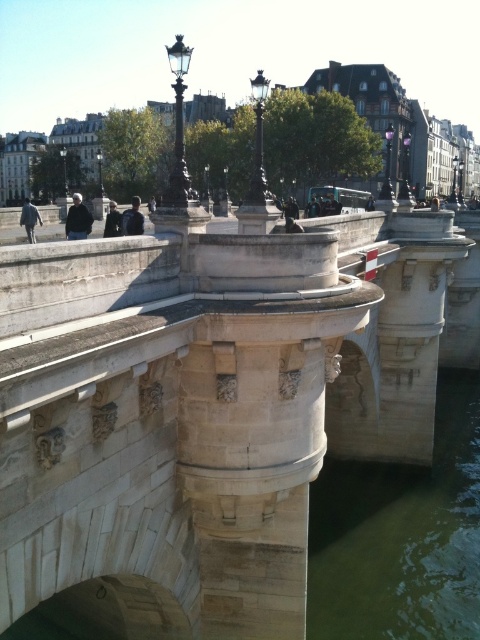
Who is more distant from viewer, (420, 460) or (368, 554)?

The point (420, 460) is more distant.

Between beige stone bridge at center and green stone water at lower right, which one is positioned higher?

beige stone bridge at center is above.

What do you see at coordinates (213, 403) in the screenshot?
I see `beige stone bridge at center` at bounding box center [213, 403].

You are a GUI agent. You are given a task and a screenshot of the screen. Output one action in this format:
    pyautogui.click(x=<x>, y=<y>)
    Task: Click on the beige stone bridge at center
    The height and width of the screenshot is (640, 480).
    Given the screenshot: What is the action you would take?
    pyautogui.click(x=213, y=403)